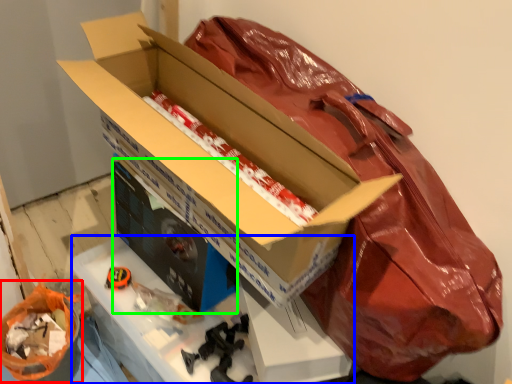
Question: Which object is the farthest from wrapping paper (highlighted by a red box)? Choose among these: workbench (highlighted by a blue box) or box (highlighted by a green box).

Choices:
 (A) workbench
 (B) box

Answer: (B)